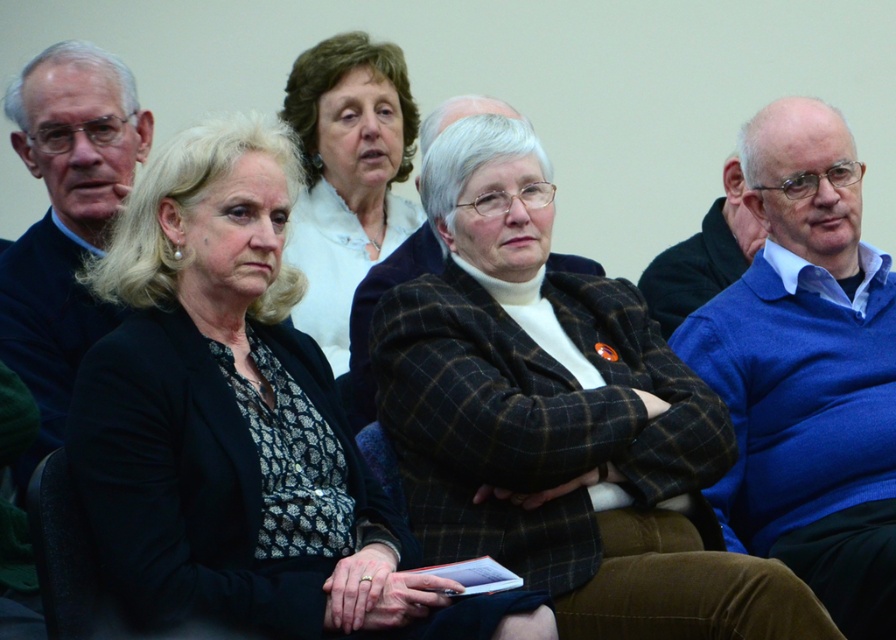
Looking at this image, does black textured blazer at center come in front of white woolen sweater at upper center?

Yes, it is in front of white woolen sweater at upper center.

Does black textured blazer at center appear on the right side of white woolen sweater at upper center?

No, black textured blazer at center is not to the right of white woolen sweater at upper center.

Which is in front, point (246, 456) or point (341, 276)?

Point (246, 456)

You are a GUI agent. You are given a task and a screenshot of the screen. Output one action in this format:
    pyautogui.click(x=<x>, y=<y>)
    Task: Click on the black textured blazer at center
    
    Given the screenshot: What is the action you would take?
    pyautogui.click(x=239, y=420)